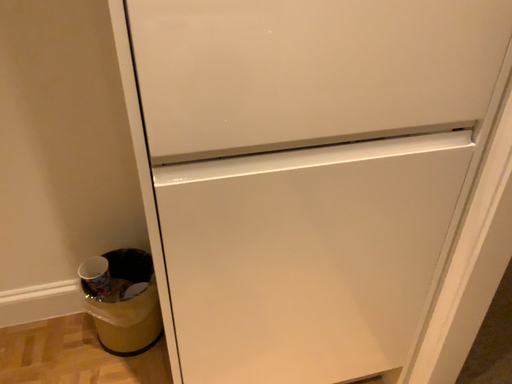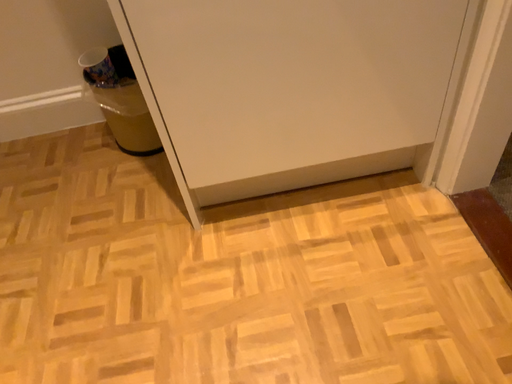
Question: Which way did the camera rotate in the video?

Choices:
 (A) rotated upward
 (B) rotated downward

Answer: (B)